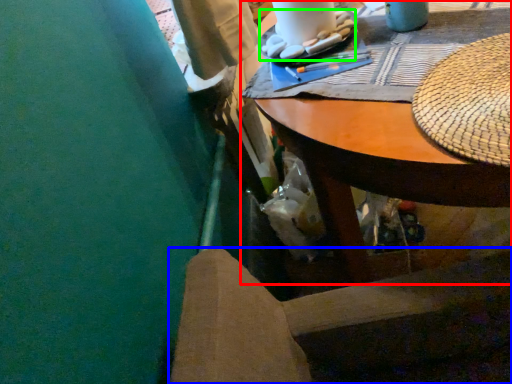
Question: Which object is positioned farthest from desk (highlighted by a red box)? Select from chair (highlighted by a blue box) and food (highlighted by a green box).

Choices:
 (A) chair
 (B) food

Answer: (A)